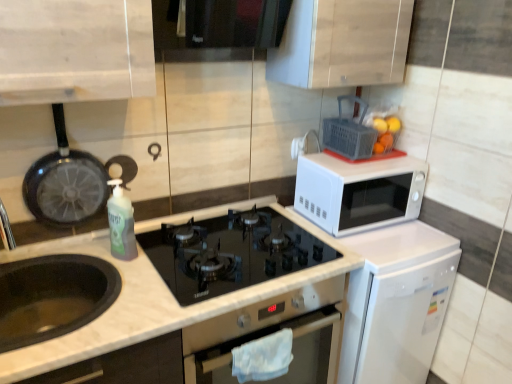
Question: Does metallic silver oven at center lie in front of black glass gas stove at center?

Choices:
 (A) no
 (B) yes

Answer: (B)

Question: Is metallic silver oven at center oriented away from black glass gas stove at center?

Choices:
 (A) no
 (B) yes

Answer: (B)

Question: Can you confirm if metallic silver oven at center is wider than black glass gas stove at center?

Choices:
 (A) yes
 (B) no

Answer: (B)

Question: Can you confirm if metallic silver oven at center is positioned to the left of black glass gas stove at center?

Choices:
 (A) no
 (B) yes

Answer: (A)

Question: Is metallic silver oven at center next to black glass gas stove at center?

Choices:
 (A) yes
 (B) no

Answer: (B)

Question: Is black matte sink at lower left spatially inside white matte dishwasher at right, or outside of it?

Choices:
 (A) outside
 (B) inside

Answer: (A)

Question: In terms of height, does black matte sink at lower left look taller or shorter compared to white matte dishwasher at right?

Choices:
 (A) tall
 (B) short

Answer: (B)

Question: Is black matte sink at lower left in front of or behind white matte dishwasher at right in the image?

Choices:
 (A) behind
 (B) front

Answer: (B)

Question: Does point (13, 304) appear closer or farther from the camera than point (380, 380)?

Choices:
 (A) closer
 (B) farther

Answer: (A)

Question: In terms of width, does translucent plastic bottle at center-left look wider or thinner when compared to black matte sink at lower left?

Choices:
 (A) thin
 (B) wide

Answer: (A)

Question: From a real-world perspective, is translucent plastic bottle at center-left above or below black matte sink at lower left?

Choices:
 (A) above
 (B) below

Answer: (A)

Question: Relative to black matte sink at lower left, is translucent plastic bottle at center-left in front or behind?

Choices:
 (A) front
 (B) behind

Answer: (B)

Question: From their relative heights in the image, would you say translucent plastic bottle at center-left is taller or shorter than black matte sink at lower left?

Choices:
 (A) tall
 (B) short

Answer: (A)

Question: Looking at the image, does wooden cabinet at upper center seem bigger or smaller compared to white plastic electric outlet at upper right?

Choices:
 (A) small
 (B) big

Answer: (B)

Question: From the image's perspective, is wooden cabinet at upper center located above or below white plastic electric outlet at upper right?

Choices:
 (A) above
 (B) below

Answer: (A)